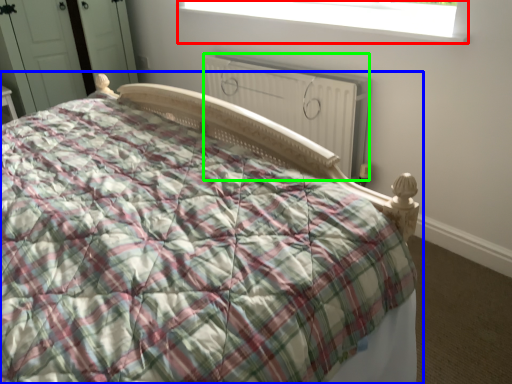
Question: Which object is the farthest from window (highlighted by a red box)? Choose among these: bed (highlighted by a blue box) or radiator (highlighted by a green box).

Choices:
 (A) bed
 (B) radiator

Answer: (A)